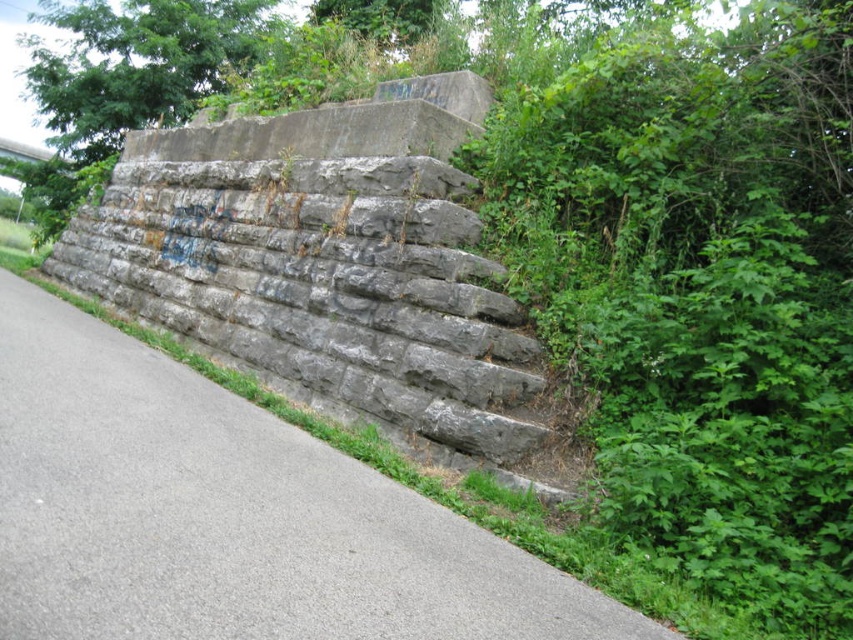
Can you confirm if gray stone wall at center is positioned below gray concrete wall at center?

Yes, gray stone wall at center is below gray concrete wall at center.

From the picture: Which is below, gray stone wall at center or gray concrete wall at center?

gray stone wall at center is below.

Who is more forward, (254, 436) or (404, 360)?

Point (254, 436) is in front.

Find the location of a particular element. gray stone wall at center is located at coordinates (228, 515).